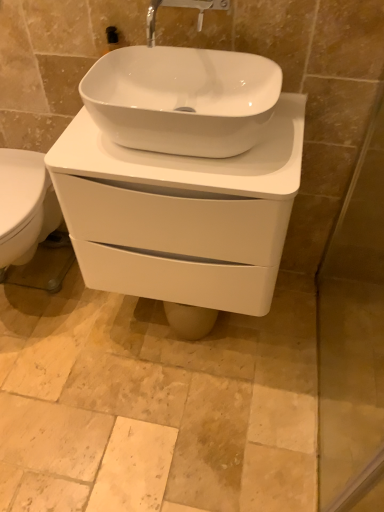
Question: Is white glossy porcelain at center smaller than matte silver faucet at upper center?

Choices:
 (A) yes
 (B) no

Answer: (B)

Question: Is white glossy porcelain at center shorter than matte silver faucet at upper center?

Choices:
 (A) no
 (B) yes

Answer: (A)

Question: Can you confirm if white glossy porcelain at center is positioned to the right of matte silver faucet at upper center?

Choices:
 (A) no
 (B) yes

Answer: (B)

Question: Is the surface of white glossy porcelain at center in direct contact with matte silver faucet at upper center?

Choices:
 (A) yes
 (B) no

Answer: (B)

Question: From a real-world perspective, is white glossy porcelain at center physically above matte silver faucet at upper center?

Choices:
 (A) yes
 (B) no

Answer: (B)

Question: In the image, is white glossy sink at center on the left side or the right side of matte silver faucet at upper center?

Choices:
 (A) left
 (B) right

Answer: (A)

Question: Looking at the image, does white glossy sink at center seem bigger or smaller compared to matte silver faucet at upper center?

Choices:
 (A) big
 (B) small

Answer: (A)

Question: From the image's perspective, relative to matte silver faucet at upper center, is white glossy sink at center above or below?

Choices:
 (A) above
 (B) below

Answer: (B)

Question: Is point (200, 108) positioned closer to the camera than point (196, 31)?

Choices:
 (A) farther
 (B) closer

Answer: (B)

Question: Considering the relative positions of white glossy porcelain at center and transparent glass screen door at right in the image provided, is white glossy porcelain at center to the left or to the right of transparent glass screen door at right?

Choices:
 (A) right
 (B) left

Answer: (B)

Question: Choose the correct answer: Is white glossy porcelain at center inside transparent glass screen door at right or outside it?

Choices:
 (A) inside
 (B) outside

Answer: (B)

Question: Considering the positions of white glossy porcelain at center and transparent glass screen door at right in the image, is white glossy porcelain at center taller or shorter than transparent glass screen door at right?

Choices:
 (A) short
 (B) tall

Answer: (A)

Question: Is point (241, 238) positioned closer to the camera than point (329, 343)?

Choices:
 (A) farther
 (B) closer

Answer: (B)

Question: Visually, is white glossy sink at center positioned to the left or to the right of transparent glass screen door at right?

Choices:
 (A) left
 (B) right

Answer: (A)

Question: From their relative heights in the image, would you say white glossy sink at center is taller or shorter than transparent glass screen door at right?

Choices:
 (A) short
 (B) tall

Answer: (A)